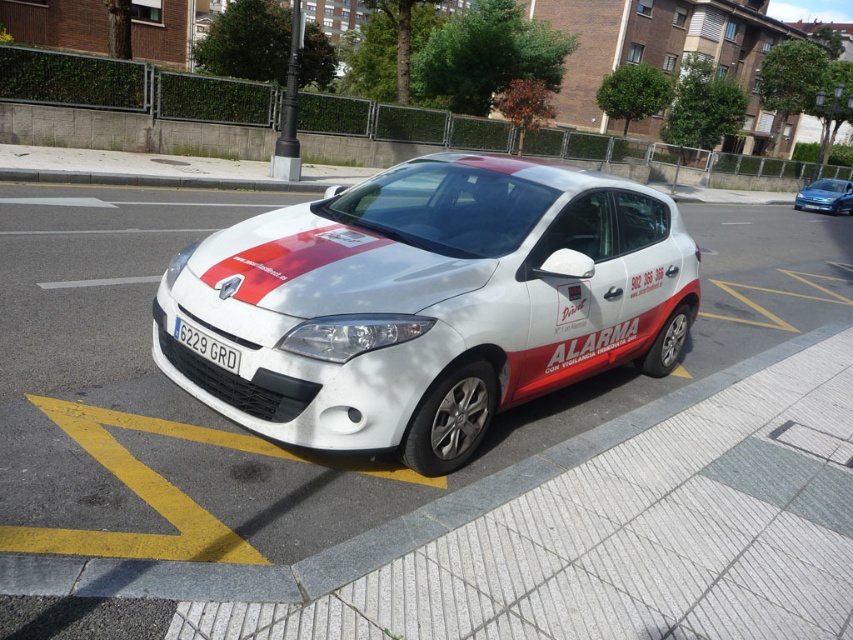
Question: Which point is closer to the camera?

Choices:
 (A) (218, 349)
 (B) (289, 438)
 (C) (834, 193)

Answer: (B)

Question: From the image, what is the correct spatial relationship of white glossy hatchback at center in relation to white matte hatchback at center?

Choices:
 (A) left
 (B) right

Answer: (A)

Question: Does white glossy hatchback at center have a smaller size compared to white plastic license plate at center?

Choices:
 (A) no
 (B) yes

Answer: (A)

Question: Which point is farther from the camera taking this photo?

Choices:
 (A) (407, 392)
 (B) (824, 202)
 (C) (221, 353)

Answer: (B)

Question: Is white glossy hatchback at center further to the viewer compared to white matte hatchback at center?

Choices:
 (A) yes
 (B) no

Answer: (B)

Question: Among these points, which one is nearest to the camera?

Choices:
 (A) (645, 193)
 (B) (198, 339)

Answer: (B)